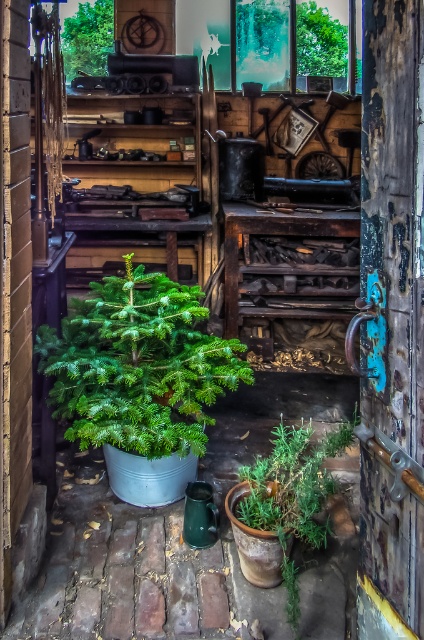
You are standing in the workshop and want to reach the point at coordinates point [97,369]. If your arm can extend 2 meters, can you reach it?

The point [97,369] is 2.39 meters away from the camera, so no, you cannot reach it with an arm that extends only 2 meters.

Consider the image. You are standing in the middle of the workshop and want to exit through the door. Based on the coordinates provided, in which direction should you walk to reach the rusty wooden door at right?

The rusty wooden door at right is located at coordinates (392,321). Since you are in the middle of the workshop, you should walk towards the right side of the room to reach the rusty wooden door at right.

You are organizing a Christmas decoration event in this workshop. You need to move the green matte potted plant at center and the green matte tree at upper center to make space. Which object should you move first to access the one behind it?

The green matte potted plant at center is in front of the green matte tree at upper center, so you should move the green matte potted plant at center first to access the one behind it.